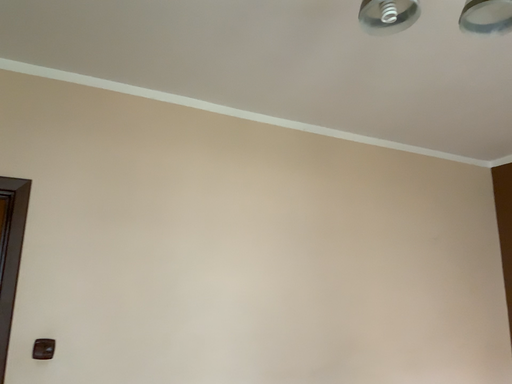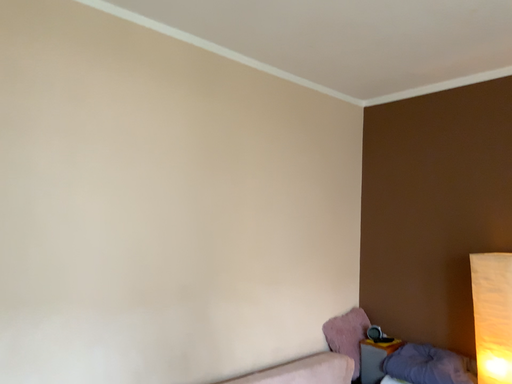
Question: Which way did the camera rotate in the video?

Choices:
 (A) rotated left
 (B) rotated right

Answer: (B)